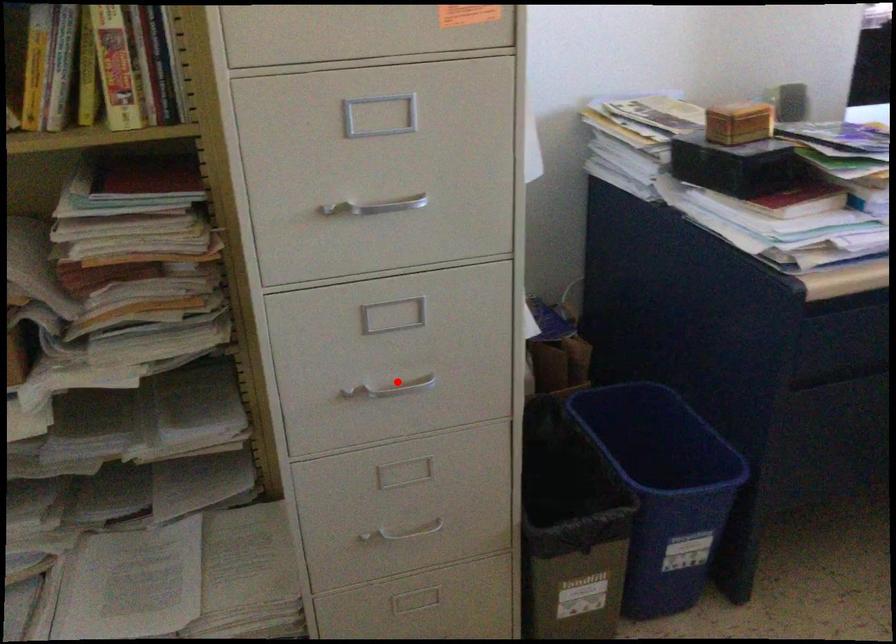
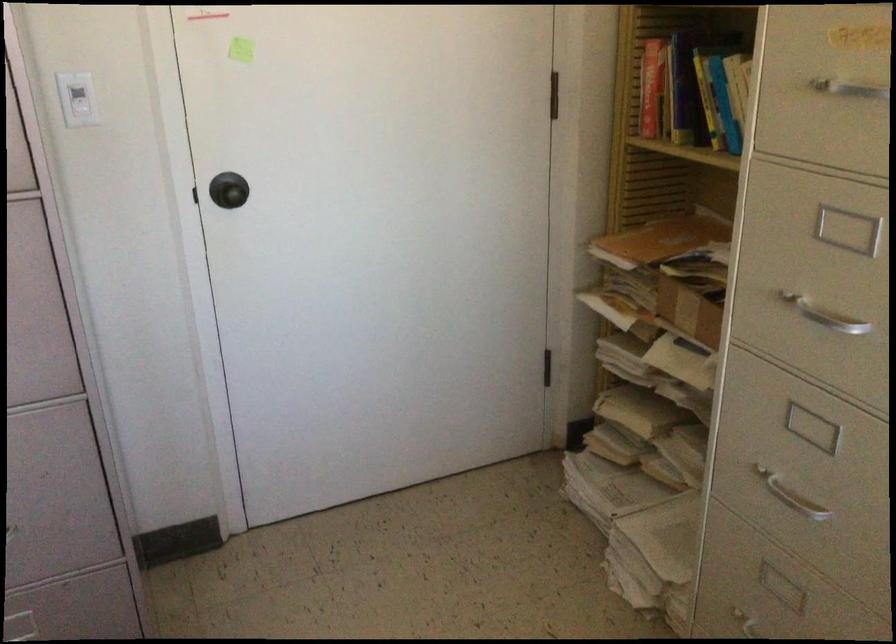
Find the pixel in the second image that matches the highlighted location in the first image.

(790, 496)